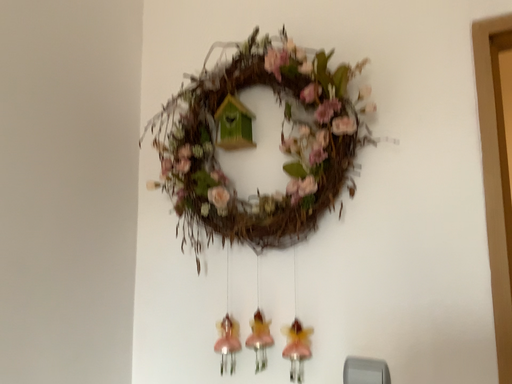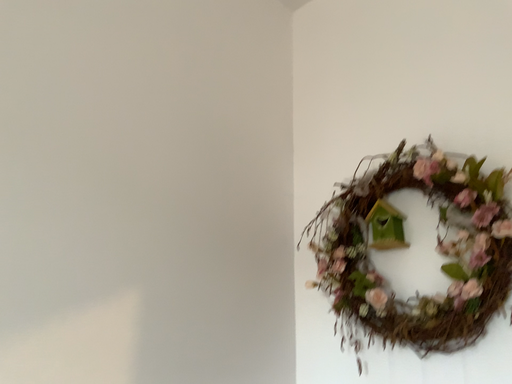
Question: Which way did the camera rotate in the video?

Choices:
 (A) rotated left
 (B) rotated right

Answer: (A)